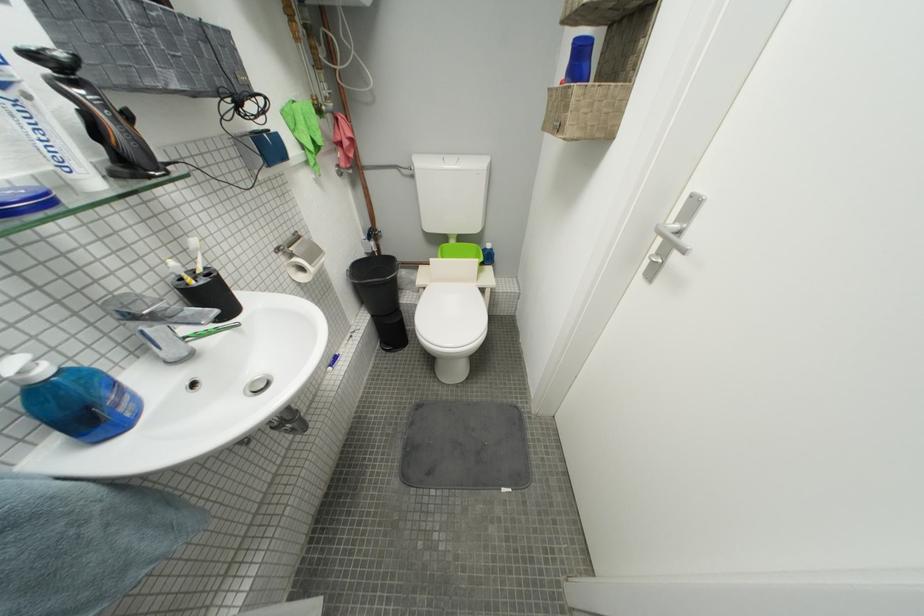
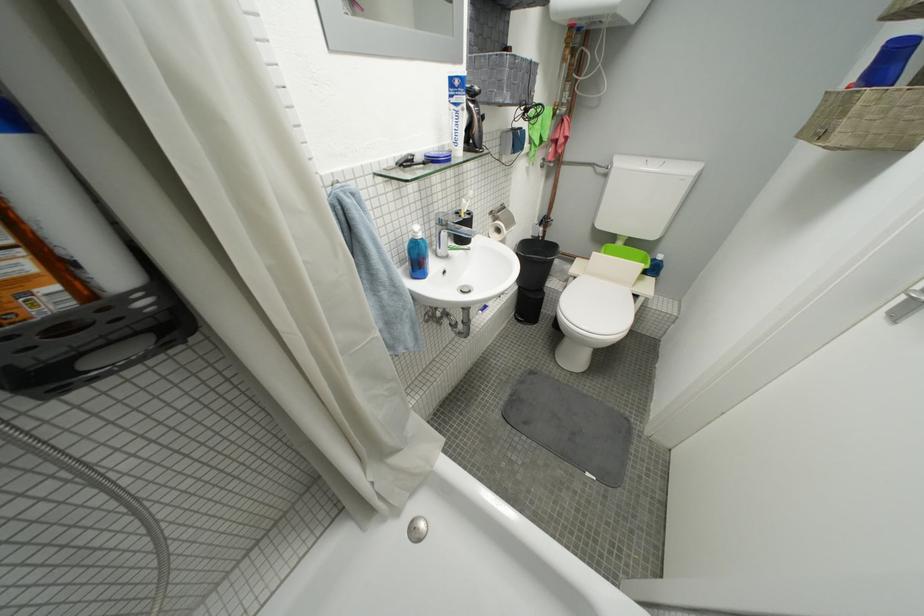
Find the pixel in the second image that matches point 653,276 in the first image.

(900, 315)